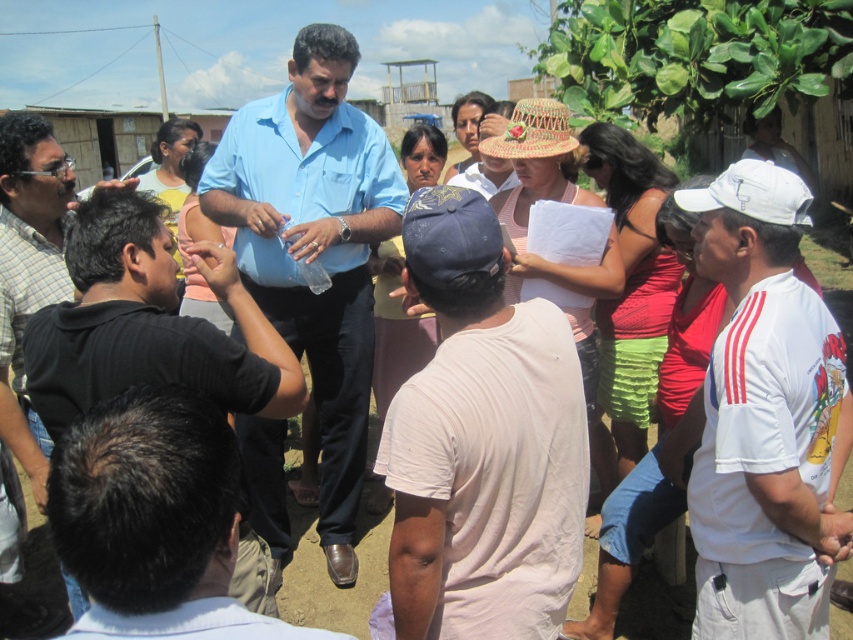
Looking at this image, you are a photographer trying to capture a candid shot of the group. You need to position yourself such that both the black shirt at lower left and the matte blue shirt at center are visible in the frame. Based on their positions, which direction should you adjust your camera to ensure both are in the shot?

The black shirt at lower left is located below the matte blue shirt at center. To include both in the frame, adjust your camera upwards slightly to ensure the matte blue shirt at center remains visible while capturing the black shirt at lower left below it.

From the picture: You are a photographer trying to capture a clear shot of the person with the dark brown hair at lower left and the brown woven straw hat at center. However, the hat is blocking part of the hair. Can you adjust your position to avoid the hat blocking the hair?

The dark brown hair at lower left is positioned under the brown woven straw hat at center, so moving your camera position lower might allow you to see the hair without the hat blocking it.

Based on the scene description, can you determine which object is shorter between the dark brown hair at lower left and the braided straw hat at center?

The dark brown hair at lower left has a lesser height compared to the braided straw hat at center, so the dark brown hair at lower left is shorter.